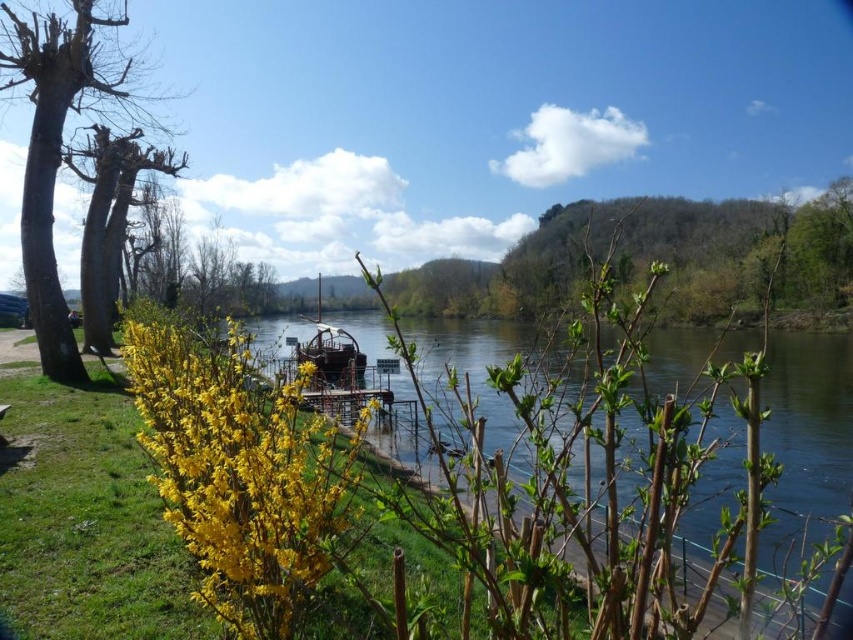
You are standing at the riverside and want to walk towards the point marked as point (335, 344). However, there is an obstacle at point marked as point (96, 68). Will you encounter this obstacle before reaching your destination?

Yes, you will encounter the obstacle at point (96, 68) before reaching point (335, 344) because point (96, 68) is in front of point (335, 344).

You are a gardener wanting to plant a new flower bed. You see the yellow matte flower at center and the wooden dock at center. Which one is shorter?

The yellow matte flower at center is shorter than the wooden dock at center.